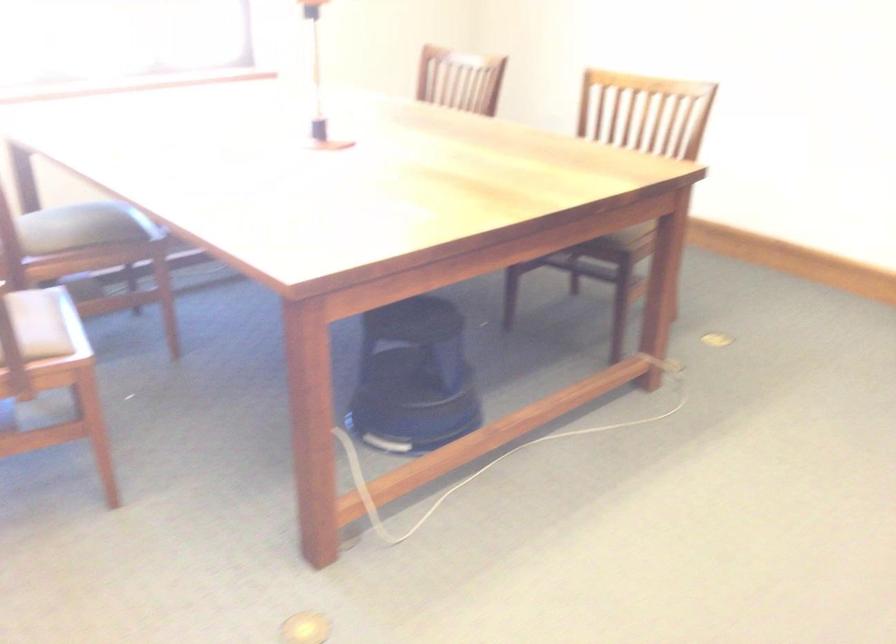
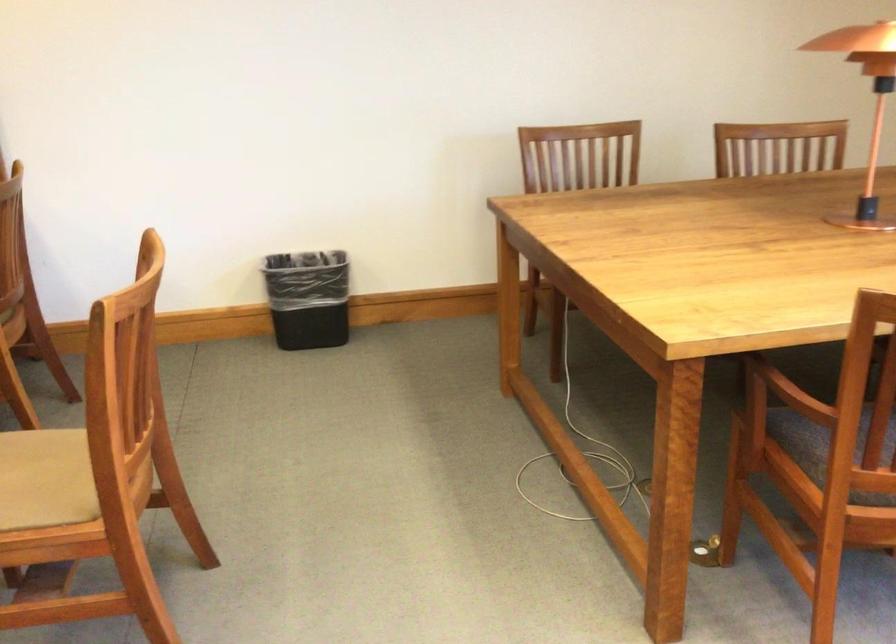
How did the camera likely rotate?

The camera's rotation is toward left-down.